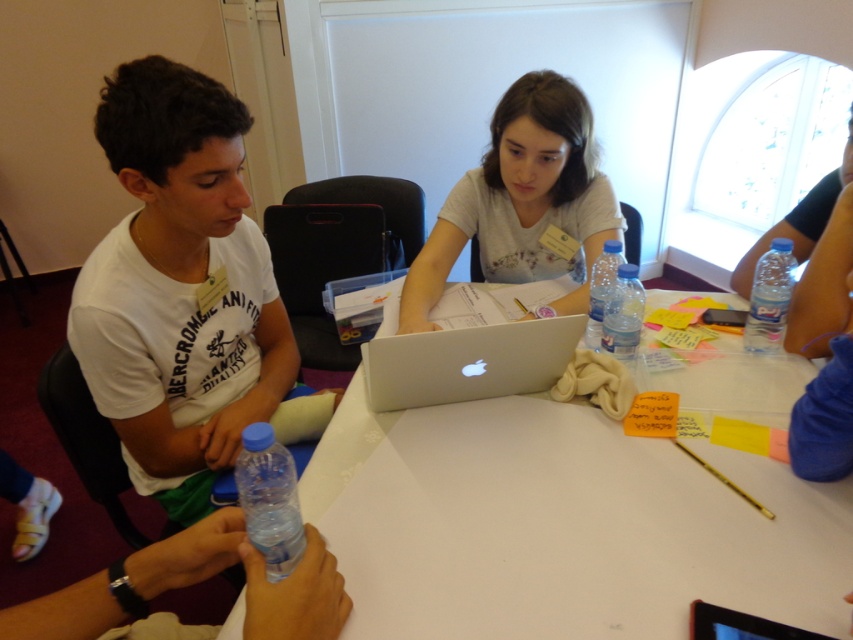
Question: Can you confirm if blue plastic bottle at lower left is smaller than clear plastic bottle at center?

Choices:
 (A) yes
 (B) no

Answer: (B)

Question: Considering the relative positions of silver metallic laptop at center and blue plastic bottle at lower left in the image provided, where is silver metallic laptop at center located with respect to blue plastic bottle at lower left?

Choices:
 (A) below
 (B) above

Answer: (B)

Question: Which point is closer to the camera taking this photo?

Choices:
 (A) (608, 340)
 (B) (292, 477)
 (C) (549, 177)
 (D) (763, 320)

Answer: (B)

Question: Among these points, which one is nearest to the camera?

Choices:
 (A) (602, 275)
 (B) (540, 112)
 (C) (463, 522)

Answer: (C)

Question: Is white matte shirt at center below clear plastic bottle at center?

Choices:
 (A) yes
 (B) no

Answer: (B)

Question: Which is farther from the white matte shirt at center?

Choices:
 (A) blue plastic bottle at lower left
 (B) clear plastic bottle at upper right

Answer: (A)